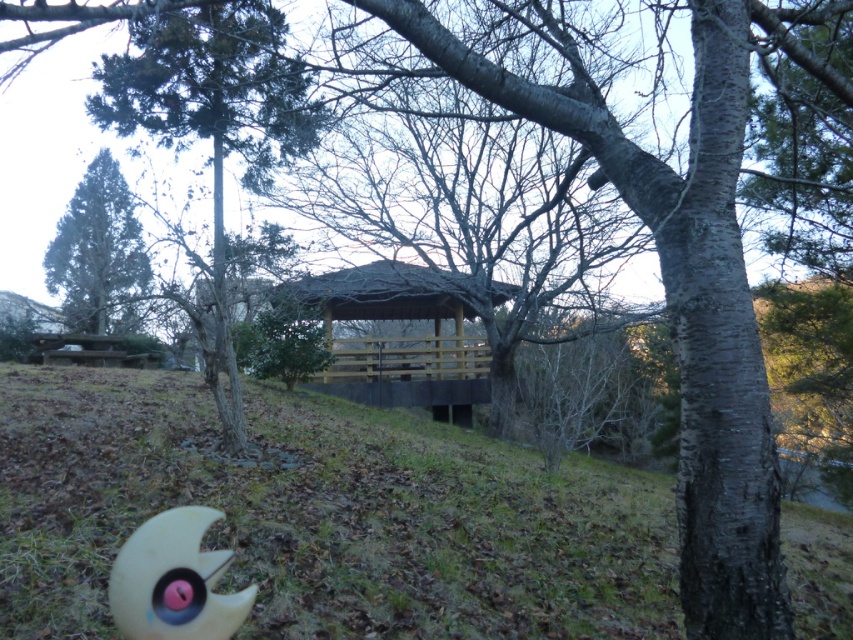
Who is positioned more to the left, wooden gazebo at center or pink rubber crescent moon at lower left?

pink rubber crescent moon at lower left

Can you confirm if wooden gazebo at center is positioned to the left of pink rubber crescent moon at lower left?

Incorrect, wooden gazebo at center is not on the left side of pink rubber crescent moon at lower left.

Image resolution: width=853 pixels, height=640 pixels. Describe the element at coordinates (387, 317) in the screenshot. I see `wooden gazebo at center` at that location.

Image resolution: width=853 pixels, height=640 pixels. I want to click on wooden gazebo at center, so click(x=387, y=317).

Identify the location of brown dry grass at lower center. The image size is (853, 640). (322, 515).

The image size is (853, 640). In order to click on brown dry grass at lower center in this screenshot , I will do `click(322, 515)`.

Which is in front, point (277, 300) or point (117, 260)?

Point (277, 300) is more forward.

Is wooden gazebo at center bigger than green matte tree at upper left?

No.

The image size is (853, 640). What do you see at coordinates (387, 317) in the screenshot?
I see `wooden gazebo at center` at bounding box center [387, 317].

Locate an element on the screen. wooden gazebo at center is located at coordinates (387, 317).